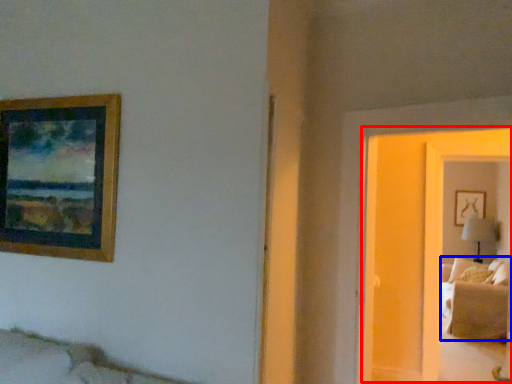
Question: Which object is further to the camera taking this photo, glass door (highlighted by a red box) or couch (highlighted by a blue box)?

Choices:
 (A) glass door
 (B) couch

Answer: (B)